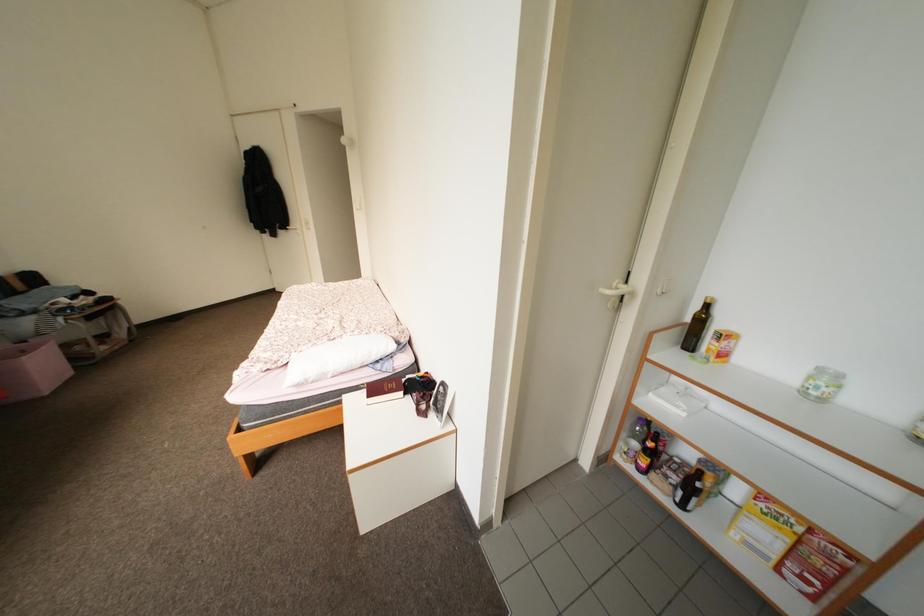
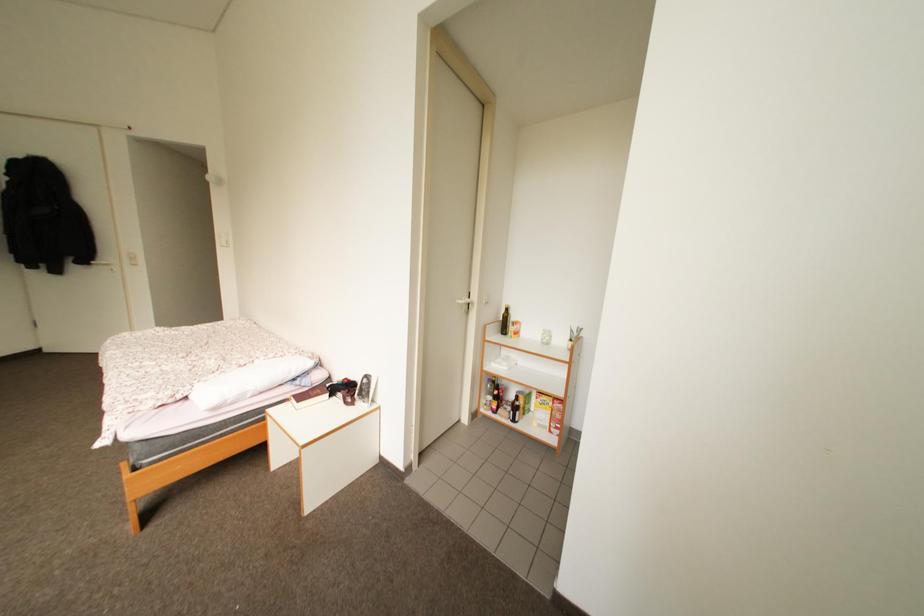
Question: The camera is either moving clockwise (left) or counter-clockwise (right) around the object. The first image is from the beginning of the video and the second image is from the end. Is the camera moving left or right when shooting the video?

Choices:
 (A) Left
 (B) Right

Answer: (A)